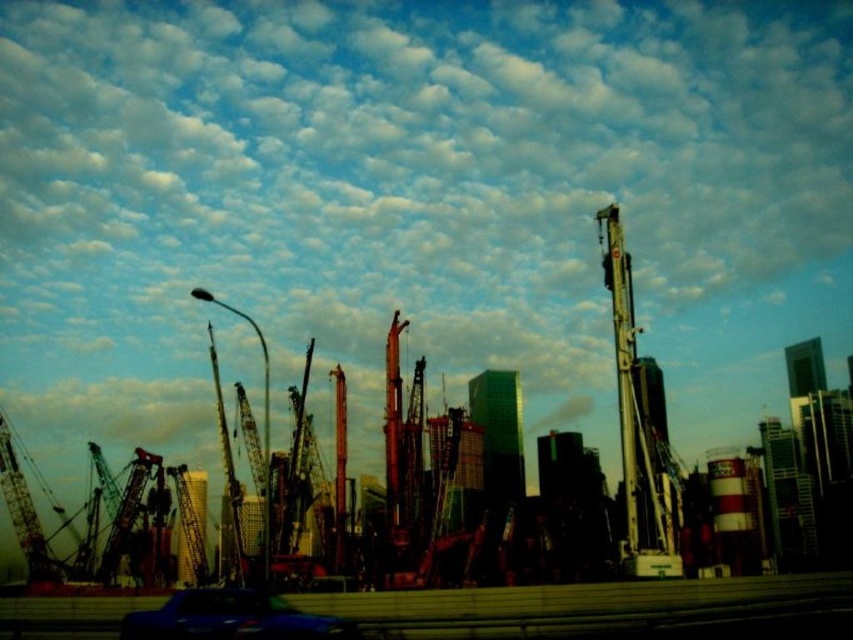
Question: Does metallic gray crane at right lie in front of metallic blue car at lower center?

Choices:
 (A) yes
 (B) no

Answer: (B)

Question: Which point is closer to the camera?

Choices:
 (A) (636, 451)
 (B) (207, 593)

Answer: (B)

Question: Is metallic gray crane at right bigger than metallic blue car at lower center?

Choices:
 (A) no
 (B) yes

Answer: (B)

Question: Does metallic gray crane at right appear on the right side of metallic blue car at lower center?

Choices:
 (A) yes
 (B) no

Answer: (A)

Question: Which of the following is the closest to the observer?

Choices:
 (A) click(x=653, y=538)
 (B) click(x=195, y=609)

Answer: (B)

Question: Which point appears closest to the camera in this image?

Choices:
 (A) 613,282
 (B) 236,605

Answer: (B)